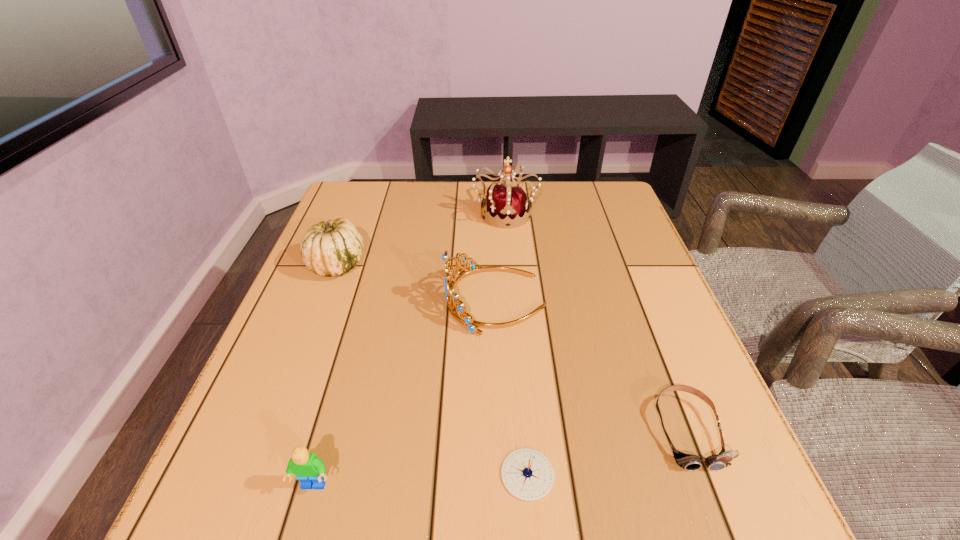
Find the location of a particular element. The image size is (960, 540). free location located 0.230m on the front-facing side of the nearer tiara is located at coordinates (342, 300).

Where is `blank space located 0.080m on the front of the gourd`? blank space located 0.080m on the front of the gourd is located at coordinates (320, 308).

Find the location of `free space located on the left of the compass`. free space located on the left of the compass is located at coordinates (367, 474).

The image size is (960, 540). What are the coordinates of `object situated at the far edge` in the screenshot? It's located at (503, 201).

Where is `Lego located at the near edge`? Lego located at the near edge is located at coordinates (310, 470).

The width and height of the screenshot is (960, 540). Find the location of `compass located in the near edge section of the desktop`. compass located in the near edge section of the desktop is located at coordinates (527, 474).

Locate an element on the screen. Image resolution: width=960 pixels, height=540 pixels. gourd that is positioned at the left edge is located at coordinates (330, 248).

Where is `Lego present at the left edge`? This screenshot has height=540, width=960. Lego present at the left edge is located at coordinates (310, 470).

This screenshot has height=540, width=960. Find the location of `object at the right edge`. object at the right edge is located at coordinates (689, 462).

Where is `object that is at the near left corner`? object that is at the near left corner is located at coordinates (310, 470).